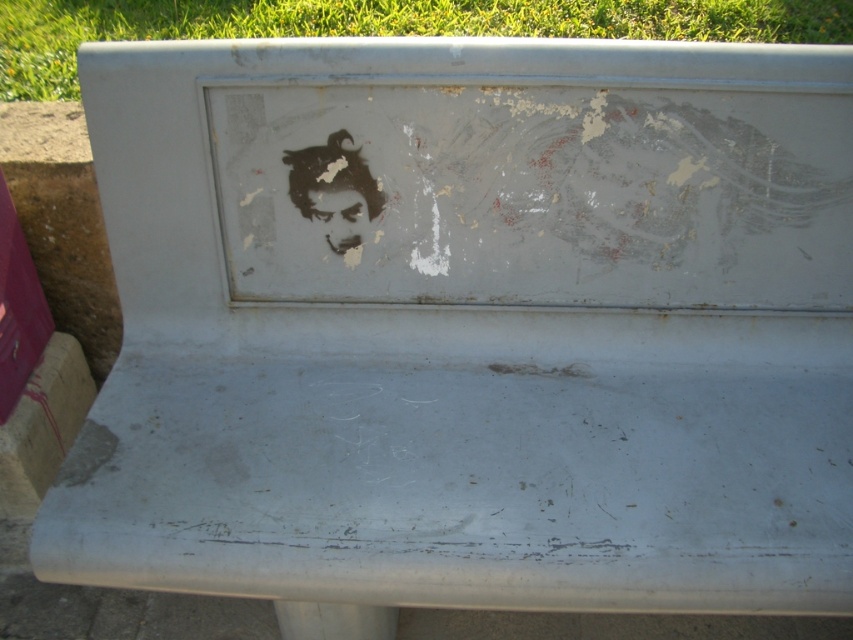
Is green grass at top bigger than matte black face at center?

Yes, green grass at top is bigger than matte black face at center.

Who is more forward, (268, 8) or (370, 218)?

Point (370, 218) is more forward.

Image resolution: width=853 pixels, height=640 pixels. In order to click on green grass at top in this screenshot , I will do `click(381, 24)`.